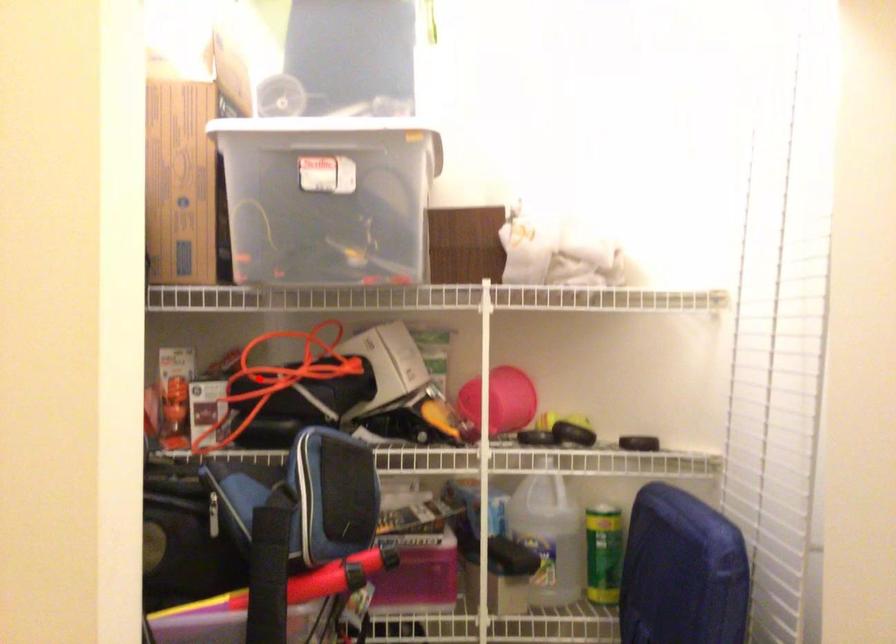
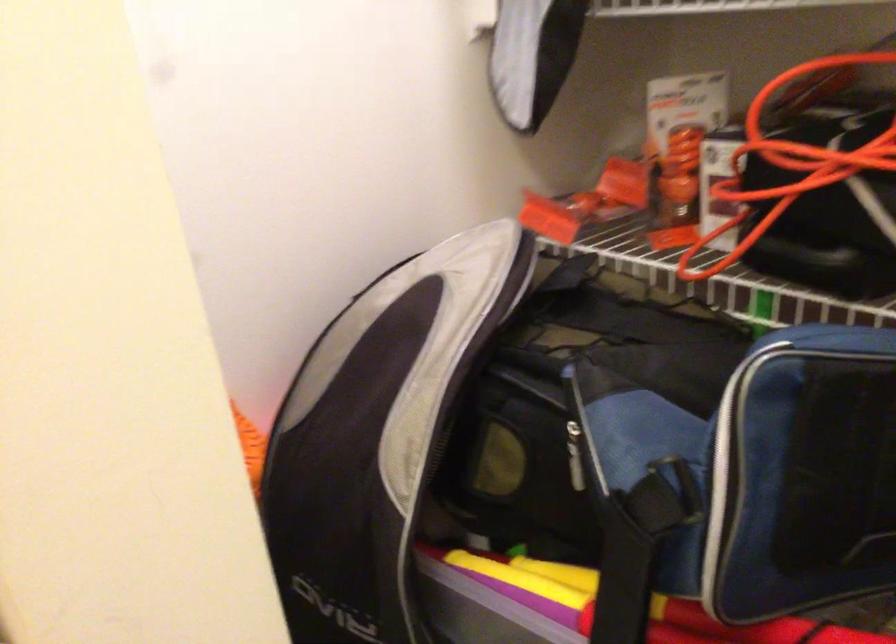
Question: I am providing you with two images of the same scene from different viewpoints. Image1 has a red point marked. In image2, the corresponding 3D location appears at what relative position? Reply with the corresponding letter.

Choices:
 (A) Closer
 (B) Farther

Answer: (A)